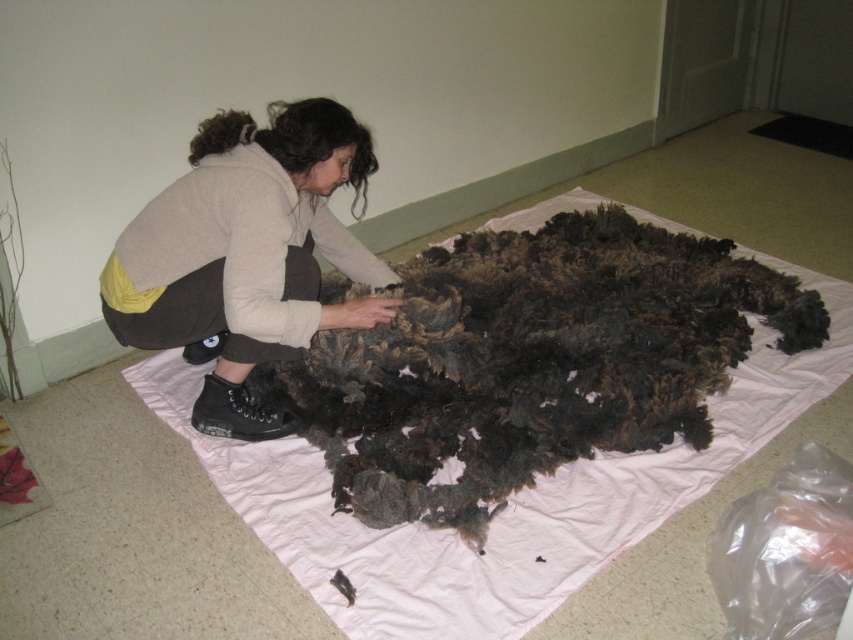
Question: Does fuzzy woolen blanket at center have a greater width compared to matte beige sweater at center?

Choices:
 (A) no
 (B) yes

Answer: (B)

Question: Where is fuzzy woolen blanket at center located in relation to matte beige sweater at center in the image?

Choices:
 (A) left
 (B) right

Answer: (B)

Question: Is fuzzy woolen blanket at center positioned in front of matte beige sweater at center?

Choices:
 (A) yes
 (B) no

Answer: (A)

Question: Which of the following is the farthest from the observer?

Choices:
 (A) fuzzy woolen blanket at center
 (B) matte beige sweater at center

Answer: (B)

Question: Which point is closer to the camera taking this photo?

Choices:
 (A) (550, 477)
 (B) (302, 342)

Answer: (A)